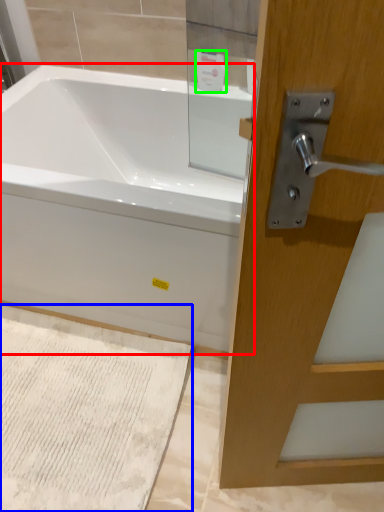
Question: Estimate the real-world distances between objects in this image. Which object is closer to bathtub (highlighted by a red box), bath mat (highlighted by a blue box) or toiletry (highlighted by a green box)?

Choices:
 (A) bath mat
 (B) toiletry

Answer: (A)